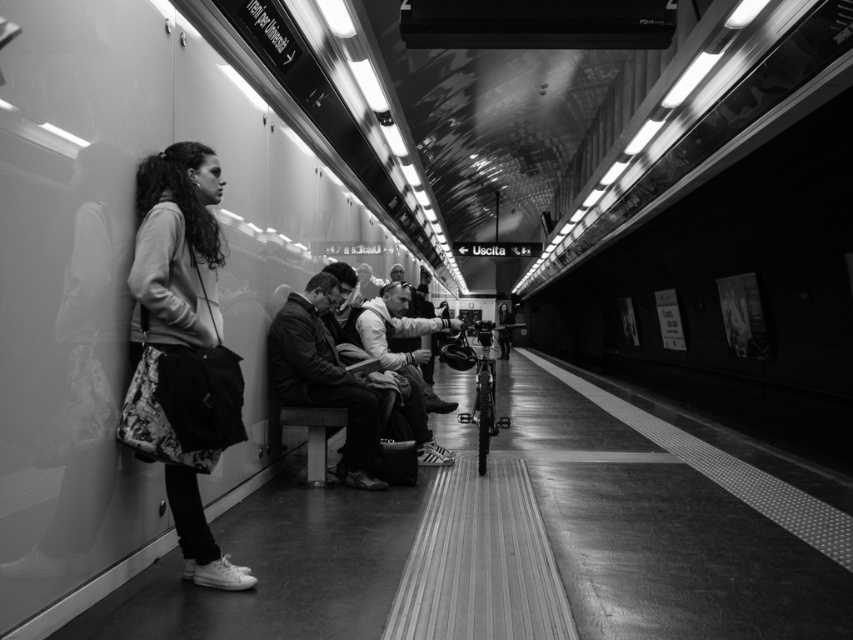
Does floral skirt at left have a greater width compared to white cotton shirt at center?

Incorrect, floral skirt at left's width does not surpass white cotton shirt at center's.

The height and width of the screenshot is (640, 853). I want to click on floral skirt at left, so click(x=183, y=348).

Find the location of a particular element. floral skirt at left is located at coordinates (183, 348).

Between leather jacket at center and white cotton shirt at center, which one appears on the right side from the viewer's perspective?

Positioned to the right is white cotton shirt at center.

Is leather jacket at center wider than white cotton shirt at center?

No.

The width and height of the screenshot is (853, 640). I want to click on leather jacket at center, so click(x=325, y=378).

Is point (152, 320) farther from viewer compared to point (346, 436)?

No, it is not.

Does floral skirt at left appear under leather jacket at center?

Actually, floral skirt at left is above leather jacket at center.

In the scene shown: Who is more forward, (137, 449) or (296, 394)?

Point (137, 449) is in front.

Locate an element on the screen. floral skirt at left is located at coordinates 183,348.